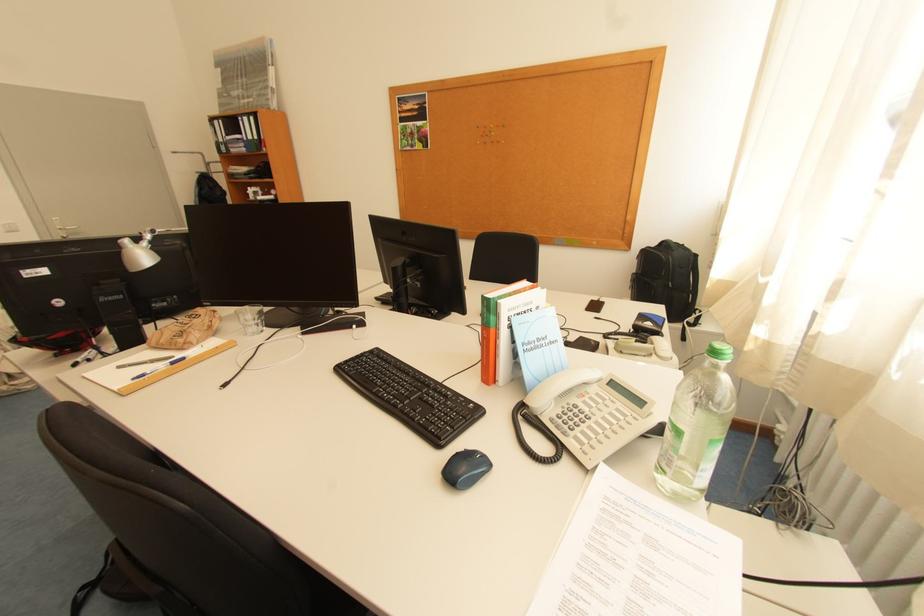
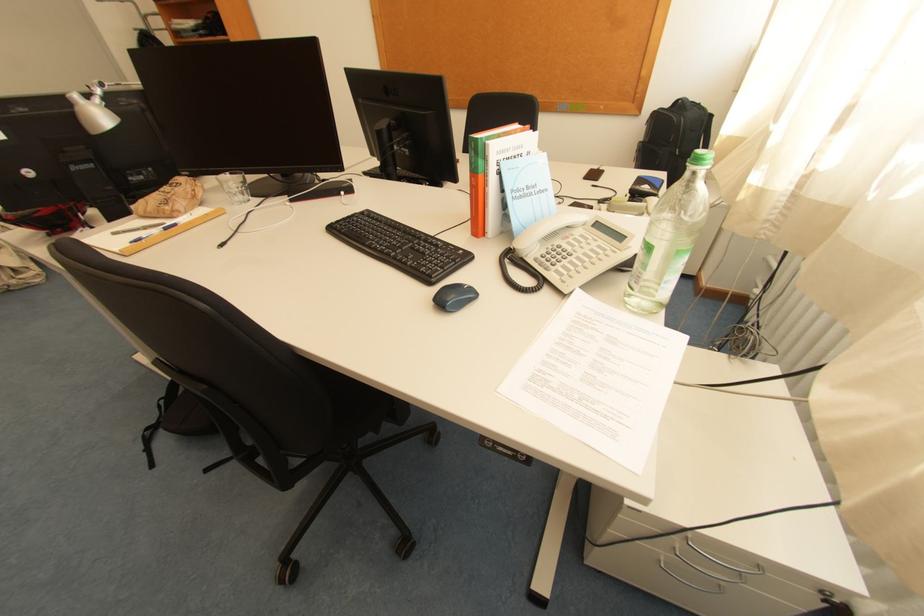
Locate, in the second image, the point that corresponds to (x=262, y=330) in the first image.

(248, 198)